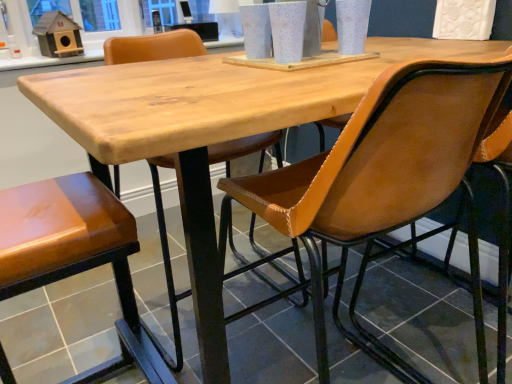
Question: Does glossy brown leather chair at lower left, positioned as the 2th chair in right-to-left order, appear on the right side of brown leather chair at center, which ranks as the 2th chair in left-to-right order?

Choices:
 (A) no
 (B) yes

Answer: (A)

Question: From a real-world perspective, is glossy brown leather chair at lower left, positioned as the 2th chair in right-to-left order, over brown leather chair at center, arranged as the first chair when viewed from the right?

Choices:
 (A) yes
 (B) no

Answer: (B)

Question: Could you tell me if glossy brown leather chair at lower left, positioned as the 2th chair in right-to-left order, is facing brown leather chair at center, which ranks as the 2th chair in left-to-right order?

Choices:
 (A) no
 (B) yes

Answer: (A)

Question: Is glossy brown leather chair at lower left, positioned as the 2th chair in right-to-left order, next to brown leather chair at center, arranged as the first chair when viewed from the right, and touching it?

Choices:
 (A) yes
 (B) no

Answer: (B)

Question: Is glossy brown leather chair at lower left, positioned as the first chair in left-to-right order, thinner than brown leather chair at center, arranged as the first chair when viewed from the right?

Choices:
 (A) yes
 (B) no

Answer: (A)

Question: Is the depth of glossy brown leather chair at lower left, positioned as the first chair in left-to-right order, greater than that of brown leather chair at center, arranged as the first chair when viewed from the right?

Choices:
 (A) yes
 (B) no

Answer: (A)

Question: Is brown leather chair at center, arranged as the first chair when viewed from the right, turned away from glossy brown leather chair at lower left, positioned as the 2th chair in right-to-left order?

Choices:
 (A) no
 (B) yes

Answer: (A)

Question: Is glossy brown leather chair at lower left, positioned as the 2th chair in right-to-left order, inside brown leather chair at center, arranged as the first chair when viewed from the right?

Choices:
 (A) no
 (B) yes

Answer: (A)

Question: From a real-world perspective, is brown leather chair at center, arranged as the first chair when viewed from the right, physically above glossy brown leather chair at lower left, positioned as the 2th chair in right-to-left order?

Choices:
 (A) yes
 (B) no

Answer: (A)

Question: Does brown leather chair at center, which ranks as the 2th chair in left-to-right order, have a greater width compared to glossy brown leather chair at lower left, positioned as the first chair in left-to-right order?

Choices:
 (A) no
 (B) yes

Answer: (B)

Question: Does brown leather chair at center, arranged as the first chair when viewed from the right, come behind glossy brown leather chair at lower left, positioned as the 2th chair in right-to-left order?

Choices:
 (A) yes
 (B) no

Answer: (B)

Question: Is brown leather chair at center, arranged as the first chair when viewed from the right, outside glossy brown leather chair at lower left, positioned as the first chair in left-to-right order?

Choices:
 (A) no
 (B) yes

Answer: (B)

Question: From the image's perspective, relative to brown leather chair at center, arranged as the first chair when viewed from the right, is glossy brown leather chair at lower left, positioned as the 2th chair in right-to-left order, above or below?

Choices:
 (A) below
 (B) above

Answer: (A)